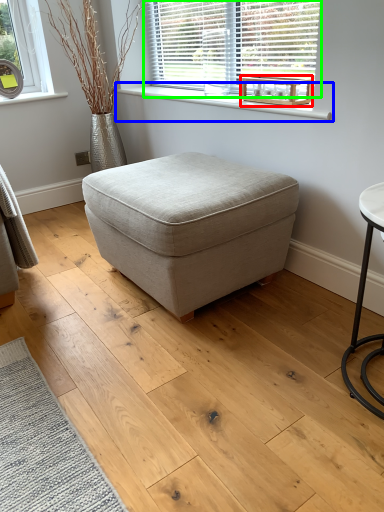
Question: Considering the real-world distances, which object is closest to round table (highlighted by a red box)? window sill (highlighted by a blue box) or window (highlighted by a green box).

Choices:
 (A) window sill
 (B) window

Answer: (A)